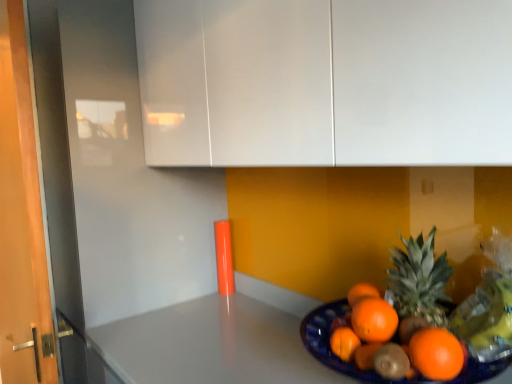
Question: Is blue glossy plate at lower right shorter than white glossy cabinet at upper center?

Choices:
 (A) no
 (B) yes

Answer: (B)

Question: Is blue glossy plate at lower right at the left side of white glossy cabinet at upper center?

Choices:
 (A) yes
 (B) no

Answer: (B)

Question: Does blue glossy plate at lower right have a smaller size compared to white glossy cabinet at upper center?

Choices:
 (A) no
 (B) yes

Answer: (B)

Question: Does blue glossy plate at lower right have a lesser width compared to white glossy cabinet at upper center?

Choices:
 (A) yes
 (B) no

Answer: (A)

Question: From a real-world perspective, is blue glossy plate at lower right located higher than white glossy cabinet at upper center?

Choices:
 (A) yes
 (B) no

Answer: (B)

Question: Is blue glossy plate at lower right outside of white glossy cabinet at upper center?

Choices:
 (A) yes
 (B) no

Answer: (A)

Question: Is white glossy cabinet at upper center not near blue glossy plate at lower right?

Choices:
 (A) yes
 (B) no

Answer: (B)

Question: Considering the relative sizes of white glossy cabinet at upper center and blue glossy plate at lower right in the image provided, is white glossy cabinet at upper center shorter than blue glossy plate at lower right?

Choices:
 (A) yes
 (B) no

Answer: (B)

Question: Does white glossy cabinet at upper center have a larger size compared to blue glossy plate at lower right?

Choices:
 (A) yes
 (B) no

Answer: (A)

Question: From the image's perspective, is white glossy cabinet at upper center located beneath blue glossy plate at lower right?

Choices:
 (A) no
 (B) yes

Answer: (A)

Question: Is white glossy cabinet at upper center to the left of blue glossy plate at lower right from the viewer's perspective?

Choices:
 (A) no
 (B) yes

Answer: (B)

Question: Is white glossy cabinet at upper center positioned behind blue glossy plate at lower right?

Choices:
 (A) yes
 (B) no

Answer: (B)

Question: Is white glossy cabinet at upper center in front of or behind blue glossy plate at lower right in the image?

Choices:
 (A) front
 (B) behind

Answer: (A)